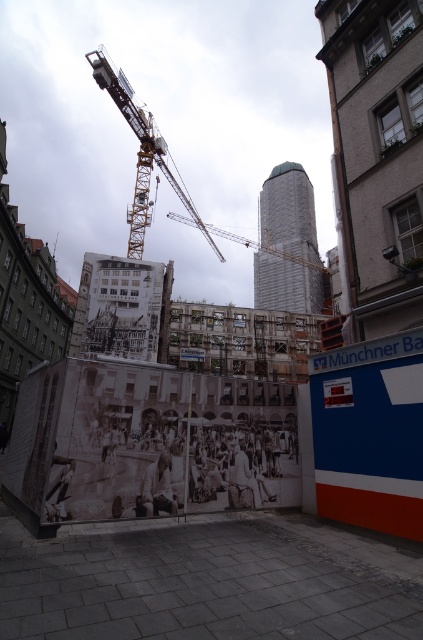
Question: Which point appears closest to the camera in this image?

Choices:
 (A) (159, 456)
 (B) (110, 77)

Answer: (A)

Question: Is yellow metallic crane at upper left positioned at the back of white fabric construction worker at lower center?

Choices:
 (A) no
 (B) yes

Answer: (B)

Question: Which object is farther from the camera taking this photo?

Choices:
 (A) yellow metallic crane at upper left
 (B) white fabric construction worker at lower center

Answer: (A)

Question: Is the position of yellow metallic crane at upper left more distant than that of white fabric construction worker at lower center?

Choices:
 (A) yes
 (B) no

Answer: (A)

Question: Can you confirm if yellow metallic crane at upper left is positioned below white fabric construction worker at lower center?

Choices:
 (A) yes
 (B) no

Answer: (B)